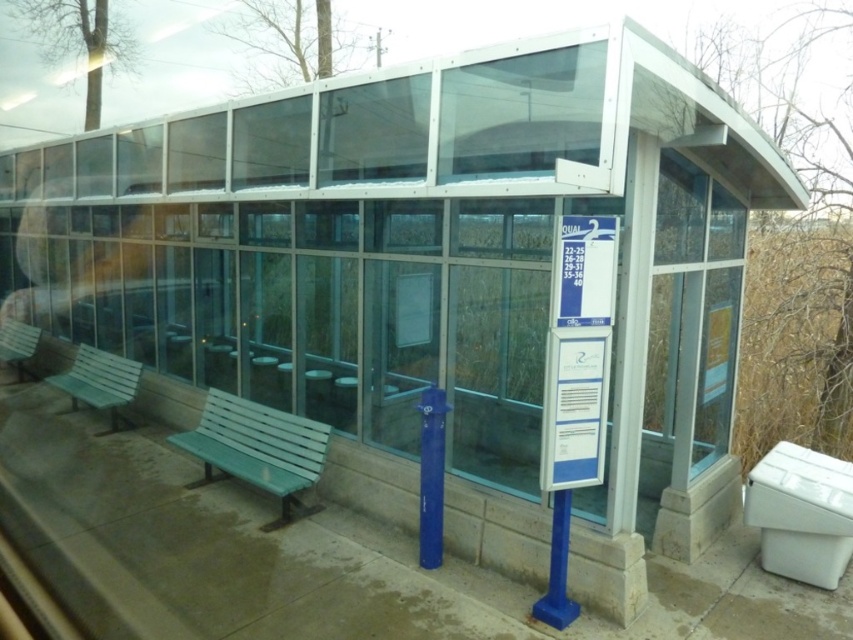
Question: From the image, what is the correct spatial relationship of white plastic toilet bowl at lower right in relation to green plastic bench at left?

Choices:
 (A) left
 (B) right

Answer: (B)

Question: In this image, where is clear glass window at center located relative to green plastic bench at lower left?

Choices:
 (A) right
 (B) left

Answer: (A)

Question: Which point appears closest to the camera in this image?

Choices:
 (A) (90, 355)
 (B) (84, 342)
 (C) (35, 346)

Answer: (A)

Question: Which of the following is the farthest from the observer?

Choices:
 (A) (293, 460)
 (B) (120, 387)

Answer: (B)

Question: Where is clear glass window at center located in relation to green plastic bench at left in the image?

Choices:
 (A) left
 (B) right

Answer: (B)

Question: Considering the real-world distances, which object is closest to the green painted wood bench at center?

Choices:
 (A) clear glass window at center
 (B) green plastic bench at left
 (C) white plastic toilet bowl at lower right

Answer: (A)